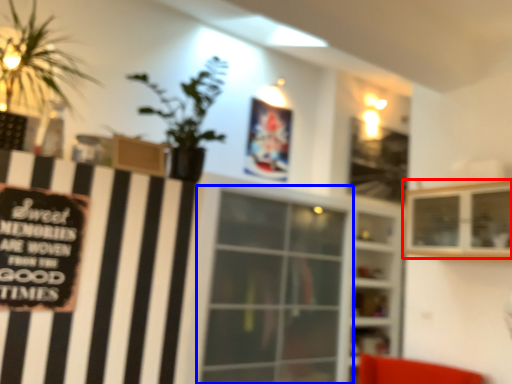
Question: Among these objects, which one is farthest to the camera, shelf (highlighted by a red box) or window (highlighted by a blue box)?

Choices:
 (A) shelf
 (B) window

Answer: (B)